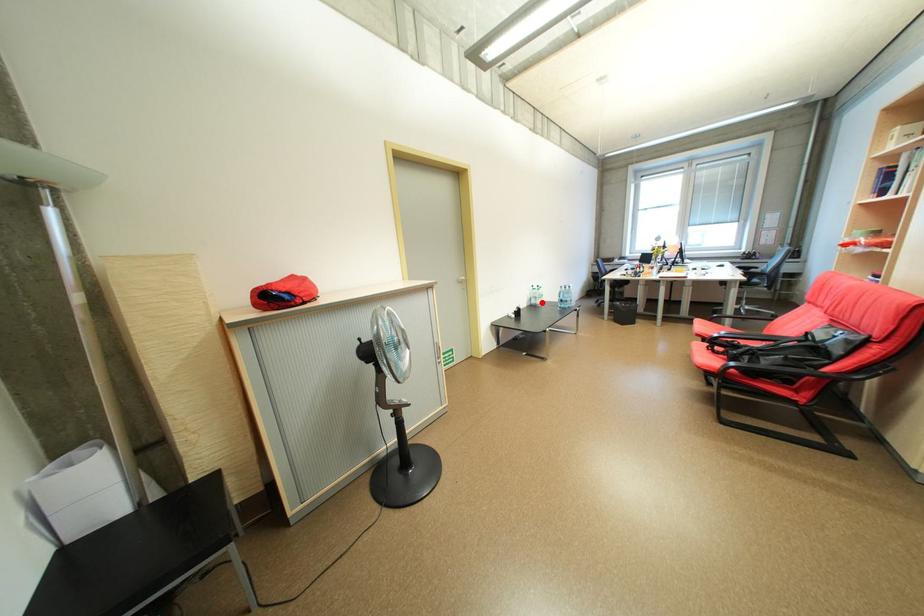
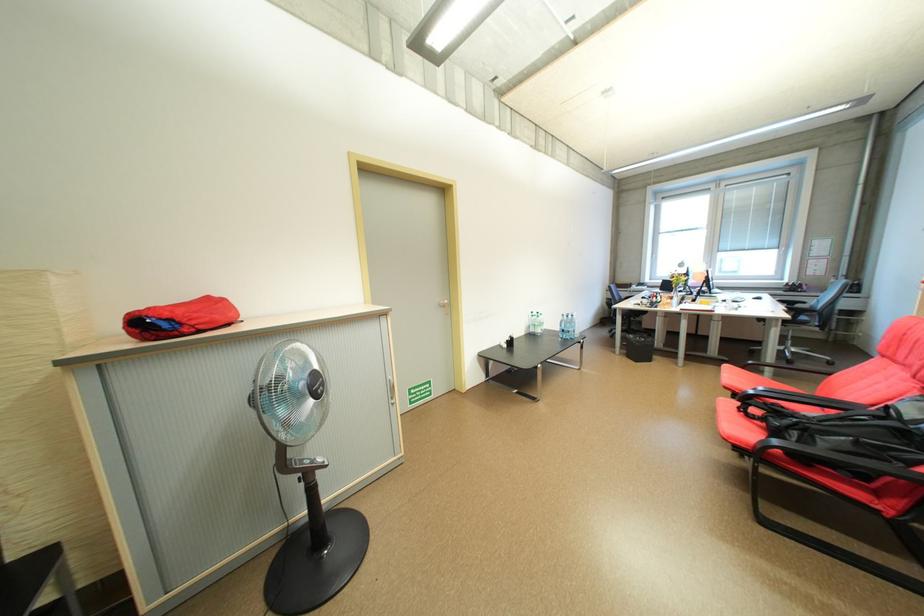
The point at the highlighted location is marked in the first image. Where is the corresponding point in the second image?

(541, 331)